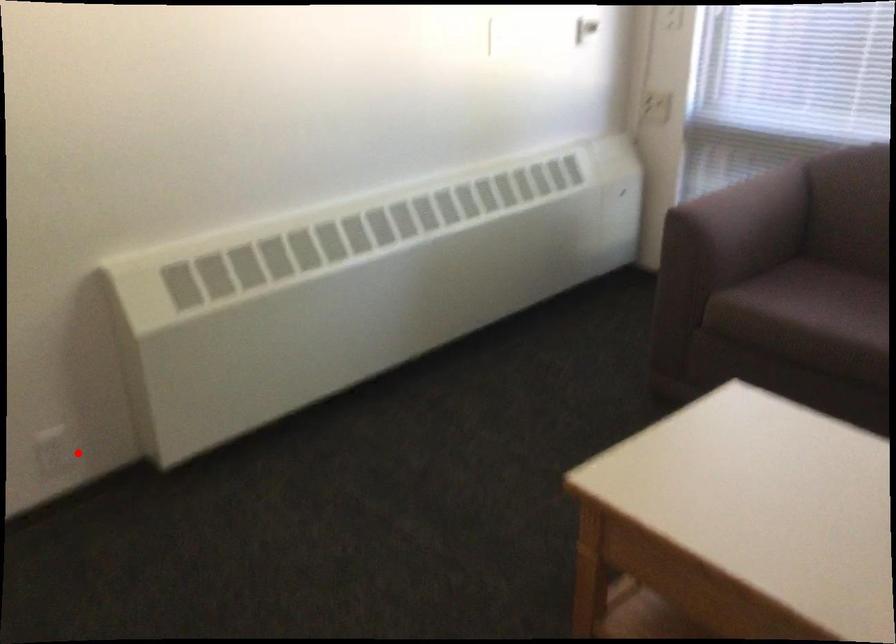
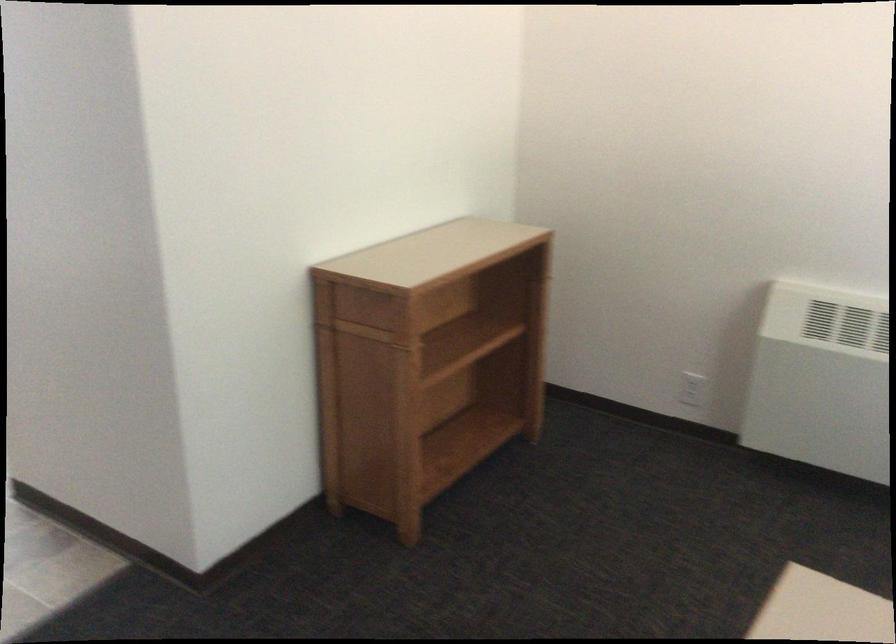
Question: I am providing you with two images of the same scene from different viewpoints. Image1 has a red point marked. In image2, the corresponding 3D location appears at what relative position? Reply with the corresponding letter.

Choices:
 (A) Closer
 (B) Farther

Answer: (B)